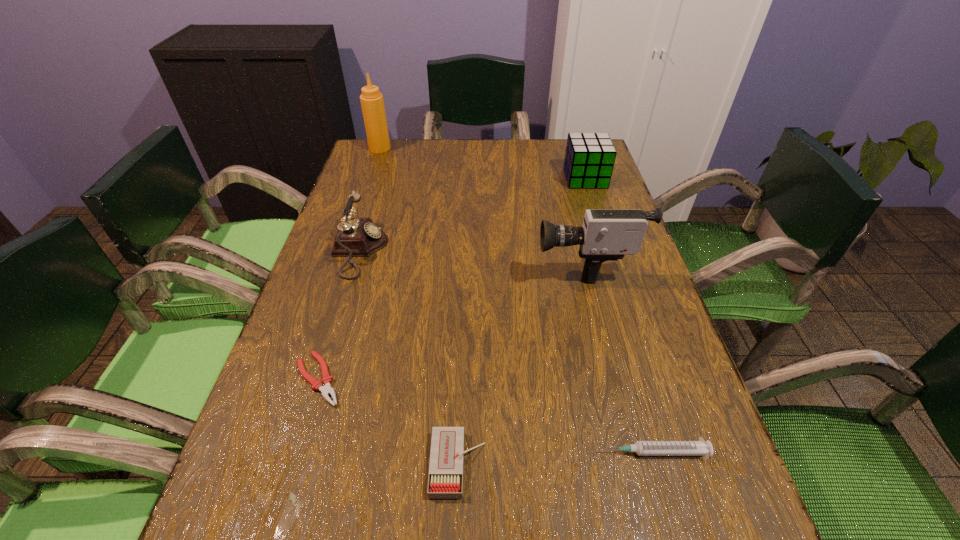
I want to click on free region located on the front of the tallest object, so click(369, 181).

You are a GUI agent. You are given a task and a screenshot of the screen. Output one action in this format:
    pyautogui.click(x=<x>, y=<y>)
    Task: Click on the vacant region located on the recording direction of the second tallest object
    The image size is (960, 540).
    Given the screenshot: What is the action you would take?
    pyautogui.click(x=430, y=263)

At what (x,y) coordinates should I click in order to perform the action: click on vacant space located 0.320m on the recording direction of the second tallest object. Please return your answer as a coordinate pair (x, y). Looking at the image, I should click on (400, 263).

The width and height of the screenshot is (960, 540). What are the coordinates of `free point located 0.310m on the recording direction of the second tallest object` in the screenshot? It's located at (405, 263).

Identify the location of free region located on the left of the sixth nearest object. The height and width of the screenshot is (540, 960). (536, 178).

This screenshot has width=960, height=540. I want to click on vacant space located 0.060m on the dial of the telephone, so click(x=411, y=251).

Image resolution: width=960 pixels, height=540 pixels. What are the coordinates of `blank space located on the striking surface of the matchbox` in the screenshot? It's located at (554, 464).

Locate an element on the screen. The width and height of the screenshot is (960, 540). blank area located at the needle end of the sixth tallest object is located at coordinates (427, 452).

This screenshot has height=540, width=960. In order to click on free spot located 0.110m at the needle end of the sixth tallest object in this screenshot , I will do `click(531, 452)`.

At what (x,y) coordinates should I click in order to perform the action: click on vacant space located at the needle end of the sixth tallest object. Please return your answer as a coordinate pair (x, y). Image resolution: width=960 pixels, height=540 pixels. Looking at the image, I should click on (452, 452).